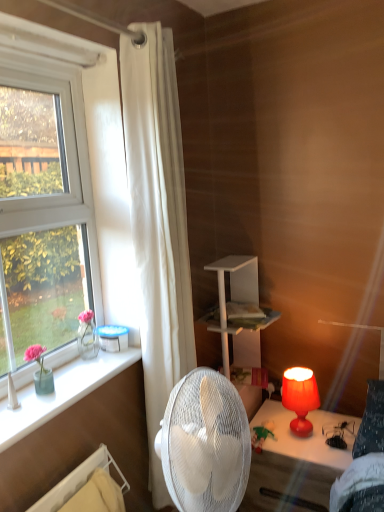
The image size is (384, 512). I want to click on matte red lamp at right, so click(x=293, y=463).

The image size is (384, 512). Describe the element at coordinates (293, 463) in the screenshot. I see `matte red lamp at right` at that location.

Locate an element on the screen. matte orange lampshade at lower right is located at coordinates (300, 398).

Is matte red lamp at right bigger than white fabric curtain at left?

Actually, matte red lamp at right might be smaller than white fabric curtain at left.

Consider the image. Is matte red lamp at right looking in the opposite direction of white fabric curtain at left?

That's not correct — matte red lamp at right is not looking away from white fabric curtain at left.

From the image's perspective, would you say matte red lamp at right is positioned over white fabric curtain at left?

Incorrect, from the image's perspective, matte red lamp at right is lower than white fabric curtain at left.

Are matte orange lampshade at lower right and white fabric curtain at left beside each other?

No, matte orange lampshade at lower right is not with white fabric curtain at left.

From the image's perspective, is matte orange lampshade at lower right located beneath white fabric curtain at left?

Yes.

Is matte orange lampshade at lower right bigger or smaller than white fabric curtain at left?

Clearly, matte orange lampshade at lower right is smaller in size than white fabric curtain at left.

Which is closer to the camera, (306,406) or (143,206)?

Point (306,406) is positioned farther from the camera compared to point (143,206).

Is point (166, 236) farther from camera compared to point (55, 378)?

Yes, it is.

From the image's perspective, is white fabric curtain at left located beneath clear glass vase at left?

Actually, white fabric curtain at left appears above clear glass vase at left in the image.

Looking at this image, is the depth of white fabric curtain at left greater than that of clear glass vase at left?

That is True.

Are matte red lamp at right and plush green bear at lower center far apart?

No.

From the image's perspective, who appears lower, matte red lamp at right or plush green bear at lower center?

matte red lamp at right.

Considering the relative sizes of matte red lamp at right and plush green bear at lower center in the image provided, is matte red lamp at right taller than plush green bear at lower center?

Yes.

Can you confirm if matte orange lampshade at lower right is positioned to the left of plush green bear at lower center?

No, matte orange lampshade at lower right is not to the left of plush green bear at lower center.

Between point (297, 380) and point (269, 428), which one is positioned in front?

Point (297, 380)

Between matte orange lampshade at lower right and plush green bear at lower center, which one is positioned in front?

Positioned in front is matte orange lampshade at lower right.

From the picture: Considering the sizes of matte orange lampshade at lower right and plush green bear at lower center in the image, is matte orange lampshade at lower right taller or shorter than plush green bear at lower center?

Clearly, matte orange lampshade at lower right is taller compared to plush green bear at lower center.

Can you confirm if clear glass vase at left is taller than matte red lamp at right?

No.

Would you consider clear glass vase at left to be distant from matte red lamp at right?

clear glass vase at left is near matte red lamp at right, not far away.

In the image, is clear glass vase at left on the left side or the right side of matte red lamp at right?

Based on their positions, clear glass vase at left is located to the left of matte red lamp at right.

Is clear glass vase at left oriented away from matte red lamp at right?

No, clear glass vase at left is not facing the opposite direction of matte red lamp at right.

Considering the relative sizes of white fabric curtain at left and matte red lamp at right in the image provided, is white fabric curtain at left smaller than matte red lamp at right?

No.

Does point (169, 180) come farther from viewer compared to point (253, 509)?

That is False.

Which object is wider, white fabric curtain at left or matte red lamp at right?

matte red lamp at right is wider.

Find the location of a particular element. curtain that is on the left side of matte red lamp at right is located at coordinates (158, 225).

At what (x,y) coordinates should I click in order to perform the action: click on curtain located above the matte orange lampshade at lower right (from a real-world perspective). Please return your answer as a coordinate pair (x, y). This screenshot has width=384, height=512. Looking at the image, I should click on (158, 225).

Which object lies further to the anchor point clear glass vase at left, plush green bear at lower center or matte red lamp at right?

Among the two, matte red lamp at right is located further to clear glass vase at left.

Based on their spatial positions, is white fabric curtain at left or matte orange lampshade at lower right closer to plush green bear at lower center?

Among the two, matte orange lampshade at lower right is located nearer to plush green bear at lower center.

Estimate the real-world distances between objects in this image. Which object is closer to clear glass vase at left, plush green bear at lower center or matte orange lampshade at lower right?

Among the two, plush green bear at lower center is located nearer to clear glass vase at left.

In the scene shown: Which object lies further to the anchor point white fabric curtain at left, matte red lamp at right or matte orange lampshade at lower right?

The object further to white fabric curtain at left is matte orange lampshade at lower right.

Estimate the real-world distances between objects in this image. Which object is further from plush green bear at lower center, matte orange lampshade at lower right or white fabric curtain at left?

white fabric curtain at left is further to plush green bear at lower center.

From the image, which object appears to be nearer to clear glass vase at left, matte red lamp at right or matte orange lampshade at lower right?

matte red lamp at right is positioned closer to the anchor clear glass vase at left.

Looking at the image, which one is located further to clear glass vase at left, white fabric curtain at left or plush green bear at lower center?

plush green bear at lower center is further to clear glass vase at left.

Based on their spatial positions, is matte orange lampshade at lower right or plush green bear at lower center further from matte red lamp at right?

plush green bear at lower center is further to matte red lamp at right.

Where is `lamp between white fabric curtain at left and matte red lamp at right from top to bottom`? The image size is (384, 512). lamp between white fabric curtain at left and matte red lamp at right from top to bottom is located at coordinates (x=300, y=398).

Identify the location of toy between white fabric curtain at left and matte red lamp at right vertically. (261, 435).

Where is `curtain between clear glass vase at left and plush green bear at lower center in the horizontal direction`? The width and height of the screenshot is (384, 512). curtain between clear glass vase at left and plush green bear at lower center in the horizontal direction is located at coordinates (158, 225).

This screenshot has height=512, width=384. Find the location of `toy between clear glass vase at left and matte orange lampshade at lower right`. toy between clear glass vase at left and matte orange lampshade at lower right is located at coordinates (261, 435).